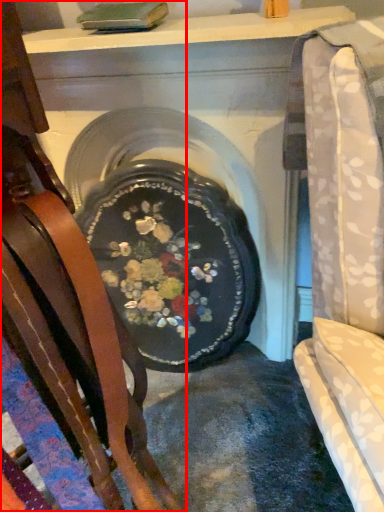
Question: From the image, what is the correct spatial relationship of chair (annotated by the red box) in relation to fireplace?

Choices:
 (A) left
 (B) right

Answer: (A)